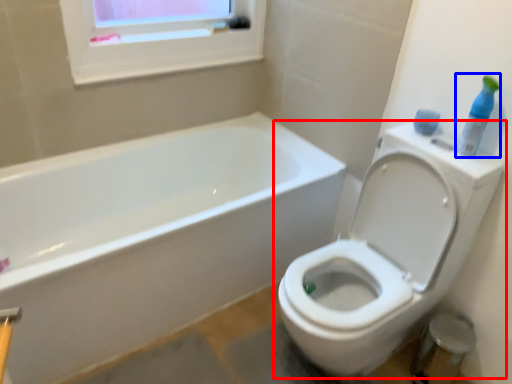
Question: Among these objects, which one is farthest to the camera, toilet (highlighted by a red box) or cleaning product (highlighted by a blue box)?

Choices:
 (A) toilet
 (B) cleaning product

Answer: (B)